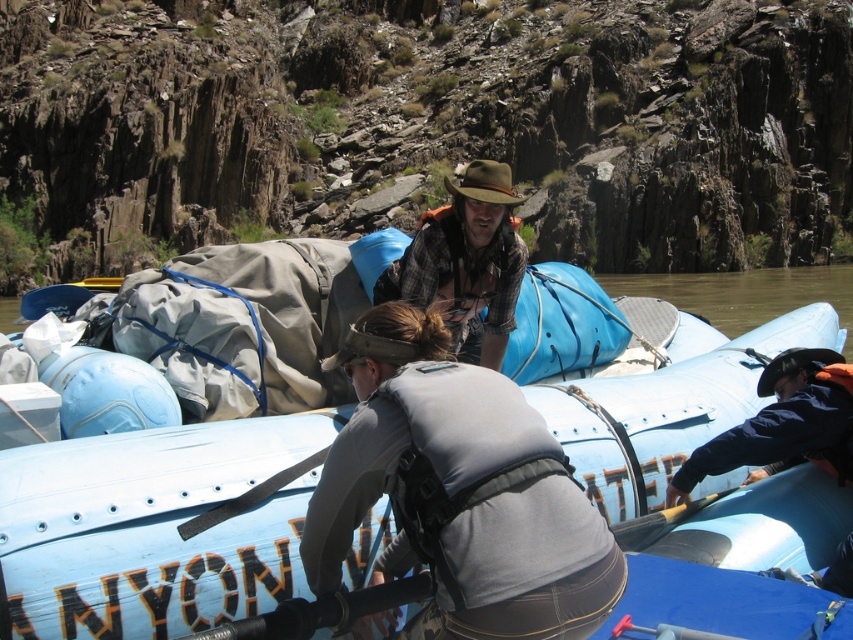
Question: Is blue rubber boat at center thinner than gray fabric life vest at center?

Choices:
 (A) no
 (B) yes

Answer: (A)

Question: Does blue rubber boat at center have a greater width compared to brown plaid shirt at center?

Choices:
 (A) no
 (B) yes

Answer: (B)

Question: Which point is farther to the camera?

Choices:
 (A) brown plaid shirt at center
 (B) gray fabric life vest at center

Answer: (A)

Question: Among these objects, which one is farthest from the camera?

Choices:
 (A) blue rubber boat at center
 (B) gray fabric life vest at center
 (C) brown plaid shirt at center

Answer: (C)

Question: Which object appears farthest from the camera in this image?

Choices:
 (A) gray fabric life vest at center
 (B) blue rubber boat at center

Answer: (B)

Question: Does blue rubber boat at center have a smaller size compared to gray fabric life vest at center?

Choices:
 (A) no
 (B) yes

Answer: (A)